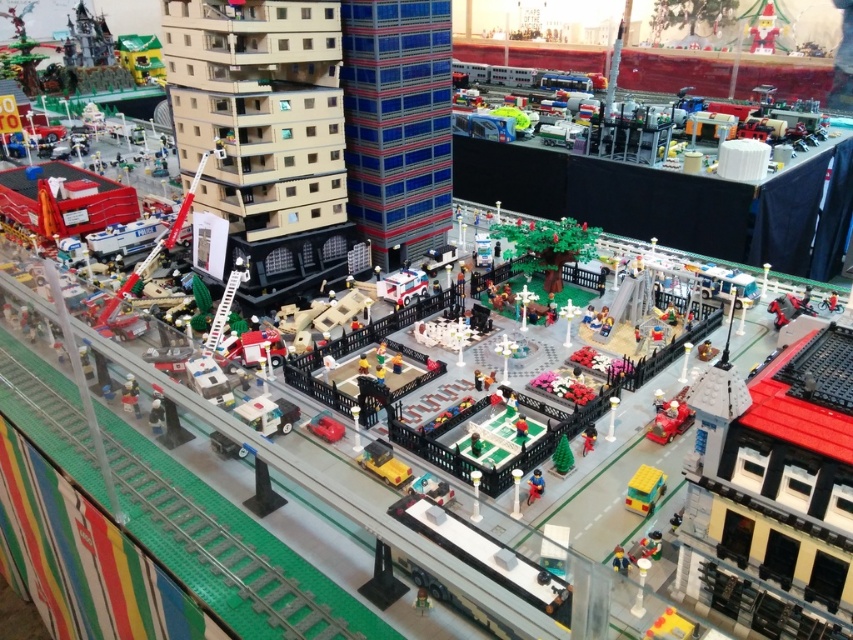
Between metallic red crane at center-left and white plastic ambulance at center, which one appears on the right side from the viewer's perspective?

Positioned to the right is white plastic ambulance at center.

Is metallic red crane at center-left to the right of white plastic ambulance at center from the viewer's perspective?

In fact, metallic red crane at center-left is to the left of white plastic ambulance at center.

Which is in front, point (173, 240) or point (419, 284)?

Point (419, 284)

The image size is (853, 640). Identify the location of metallic red crane at center-left. (161, 237).

Between yellow matte bus at lower right and shiny red car at center, which one is positioned higher?

shiny red car at center is above.

Does point (650, 474) lie behind point (654, 416)?

No, it is not.

Does point (645, 481) come behind point (682, 428)?

No, (645, 481) is closer to viewer.

In order to click on yellow matte bus at lower right in this screenshot , I will do `click(643, 490)`.

Can you confirm if shiny red car at center is thinner than smooth plastic figure at lower right?

No, shiny red car at center is not thinner than smooth plastic figure at lower right.

Between point (666, 433) and point (653, 552), which one is positioned behind?

Positioned behind is point (666, 433).

What do you see at coordinates (669, 420) in the screenshot?
I see `shiny red car at center` at bounding box center [669, 420].

I want to click on shiny red car at center, so click(x=669, y=420).